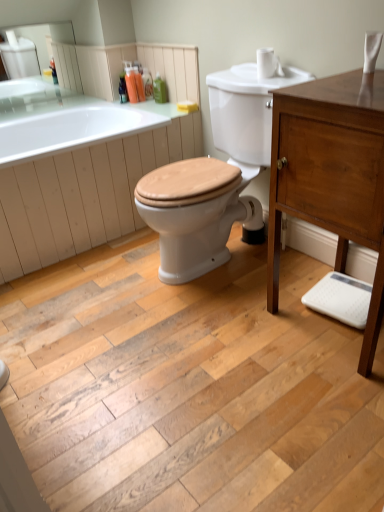
Question: Considering the relative sizes of white glossy bathtub at upper left and translucent plastic soap dispenser at upper center, which is the 1th toiletry in left-to-right order, in the image provided, is white glossy bathtub at upper left wider than translucent plastic soap dispenser at upper center, which is the 1th toiletry in left-to-right order,?

Choices:
 (A) yes
 (B) no

Answer: (A)

Question: Can you confirm if white glossy bathtub at upper left is thinner than translucent plastic soap dispenser at upper center, placed as the fourth toiletry when sorted from right to left?

Choices:
 (A) yes
 (B) no

Answer: (B)

Question: Considering the relative positions of white glossy bathtub at upper left and translucent plastic soap dispenser at upper center, which is the 1th toiletry in left-to-right order, in the image provided, is white glossy bathtub at upper left in front of translucent plastic soap dispenser at upper center, which is the 1th toiletry in left-to-right order,?

Choices:
 (A) no
 (B) yes

Answer: (B)

Question: Can you confirm if white glossy bathtub at upper left is positioned to the right of translucent plastic soap dispenser at upper center, placed as the fourth toiletry when sorted from right to left?

Choices:
 (A) yes
 (B) no

Answer: (B)

Question: Can translucent plastic soap dispenser at upper center, which is the 1th toiletry in left-to-right order, be found inside white glossy bathtub at upper left?

Choices:
 (A) yes
 (B) no

Answer: (B)

Question: Does point (155, 80) appear closer or farther from the camera than point (135, 74)?

Choices:
 (A) farther
 (B) closer

Answer: (A)

Question: Is green plastic bottle at upper center, placed as the 1th toiletry when sorted from right to left, wider or thinner than translucent plastic bottles at upper center, acting as the second toiletry starting from the left?

Choices:
 (A) thin
 (B) wide

Answer: (A)

Question: Is green plastic bottle at upper center, placed as the 1th toiletry when sorted from right to left, in front of or behind translucent plastic bottles at upper center, acting as the second toiletry starting from the left, in the image?

Choices:
 (A) behind
 (B) front

Answer: (B)

Question: In terms of height, does green plastic bottle at upper center, the 4th toiletry viewed from the left, look taller or shorter compared to translucent plastic bottles at upper center, positioned as the 3th toiletry in right-to-left order?

Choices:
 (A) short
 (B) tall

Answer: (A)

Question: Is point (147, 105) positioned closer to the camera than point (271, 61)?

Choices:
 (A) closer
 (B) farther

Answer: (B)

Question: Looking at the image, does white glossy bathtub at upper left seem bigger or smaller compared to white matte toilet paper at upper right?

Choices:
 (A) small
 (B) big

Answer: (B)

Question: From their relative heights in the image, would you say white glossy bathtub at upper left is taller or shorter than white matte toilet paper at upper right?

Choices:
 (A) tall
 (B) short

Answer: (A)

Question: Looking at their shapes, would you say white glossy bathtub at upper left is wider or thinner than white matte toilet paper at upper right?

Choices:
 (A) thin
 (B) wide

Answer: (B)

Question: Is translucent plastic bottles at upper center, positioned as the 3th toiletry in right-to-left order, wider or thinner than translucent plastic soap dispenser at upper center, which is the 1th toiletry in left-to-right order?

Choices:
 (A) thin
 (B) wide

Answer: (A)

Question: Is translucent plastic bottles at upper center, positioned as the 3th toiletry in right-to-left order, inside the boundaries of translucent plastic soap dispenser at upper center, placed as the fourth toiletry when sorted from right to left, or outside?

Choices:
 (A) inside
 (B) outside

Answer: (B)